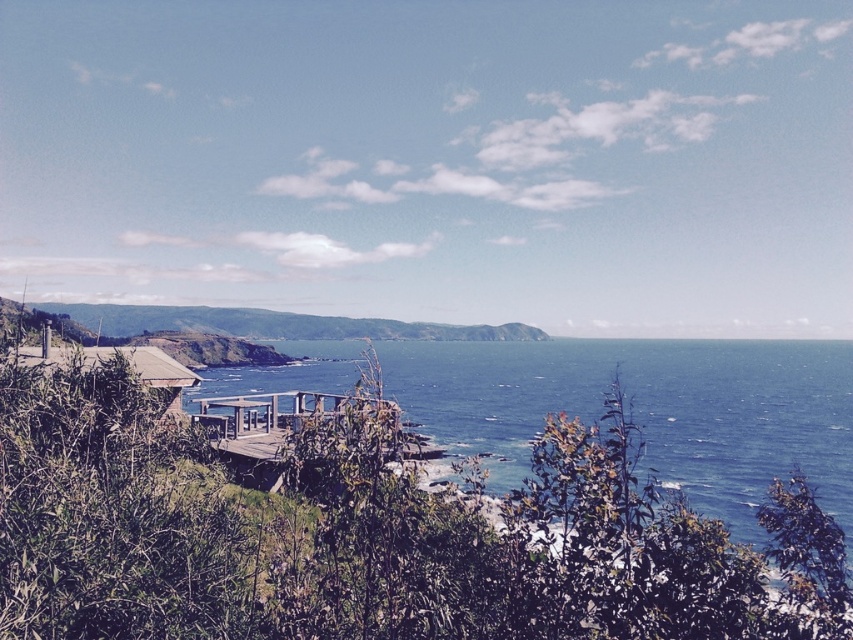
In the scene shown: Between green grassy hillside at center and wooden hut at lower left, which one has more height?

Standing taller between the two is green grassy hillside at center.

Measure the distance between point (500, 330) and camera.

The distance of point (500, 330) from camera is 326.48 meters.

You are a GUI agent. You are given a task and a screenshot of the screen. Output one action in this format:
    pyautogui.click(x=<x>, y=<y>)
    Task: Click on the green grassy hillside at center
    The width and height of the screenshot is (853, 640).
    Given the screenshot: What is the action you would take?
    pyautogui.click(x=274, y=323)

Is blue water at lower center below wooden deck at center?

Yes.

Is blue water at lower center wider than wooden deck at center?

Yes.

This screenshot has height=640, width=853. What are the coordinates of `blue water at lower center` in the screenshot? It's located at (648, 412).

This screenshot has width=853, height=640. In order to click on blue water at lower center in this screenshot , I will do `click(648, 412)`.

How far apart are blue water at lower center and wooden hut at lower left?

A distance of 166.97 meters exists between blue water at lower center and wooden hut at lower left.

Is point (688, 420) positioned after point (189, 378)?

That is True.

In order to click on blue water at lower center in this screenshot , I will do `click(648, 412)`.